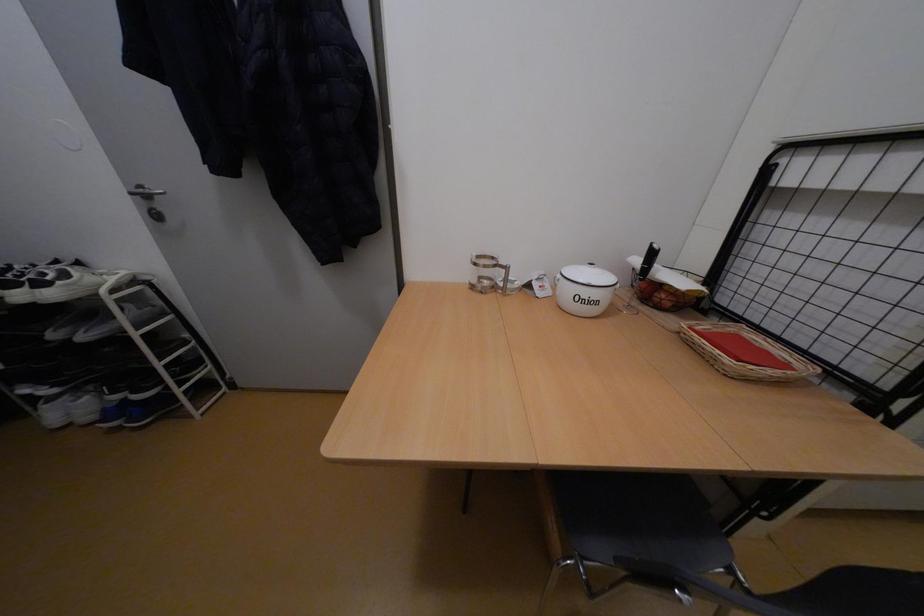
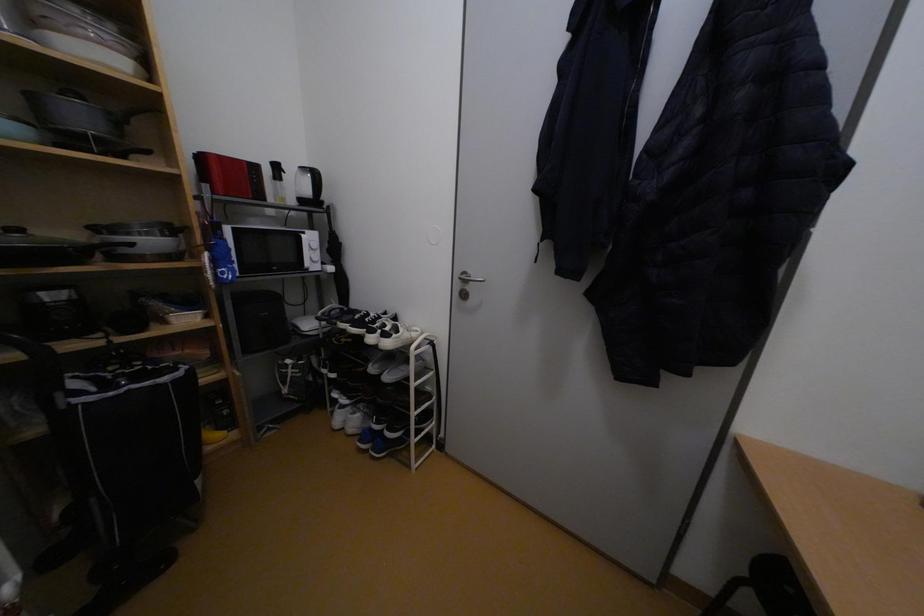
Question: The images are taken continuously from a first-person perspective. In which direction is your viewpoint rotating?

Choices:
 (A) Left
 (B) Right
 (C) Up
 (D) Down

Answer: (A)